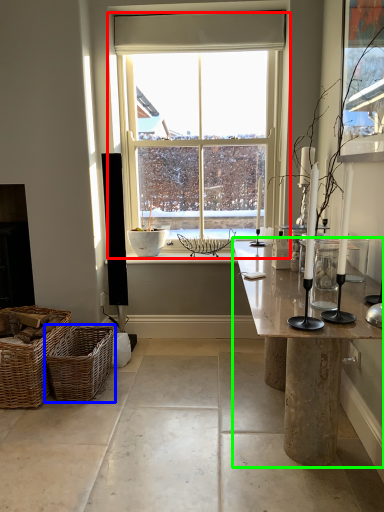
Question: Which object is the farthest from window (highlighted by a red box)? Choose among these: picnic basket (highlighted by a blue box) or table (highlighted by a green box).

Choices:
 (A) picnic basket
 (B) table

Answer: (B)